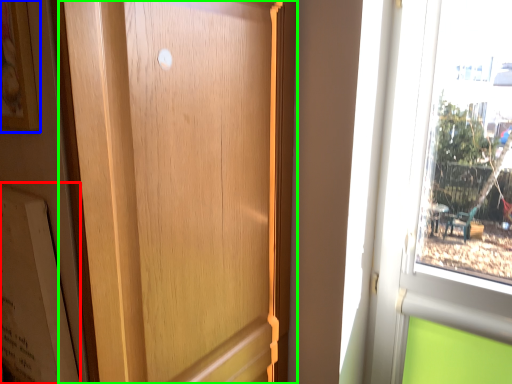
Question: Which is farther away from bulletin board (highlighted by a red box)? picture frame (highlighted by a blue box) or door (highlighted by a green box)?

Choices:
 (A) picture frame
 (B) door

Answer: (A)